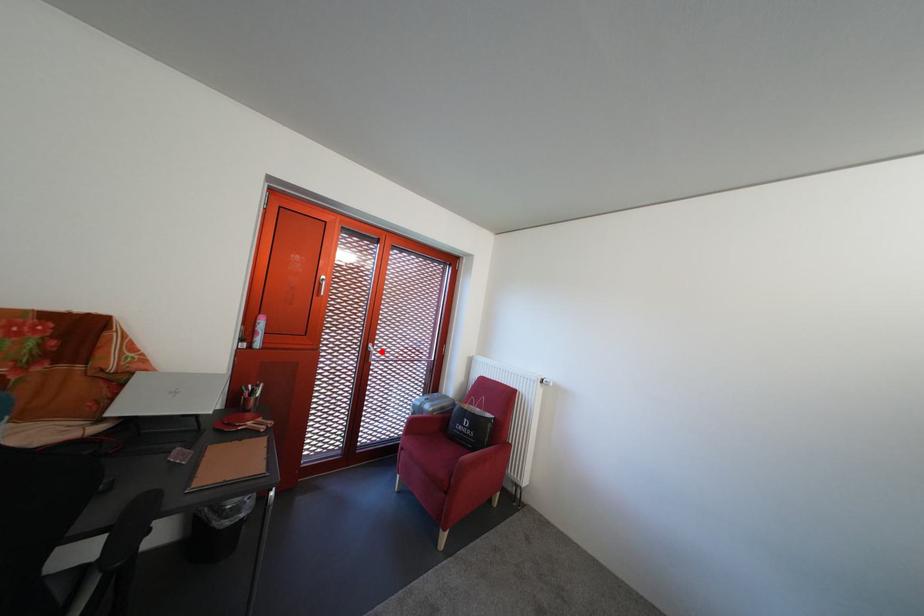
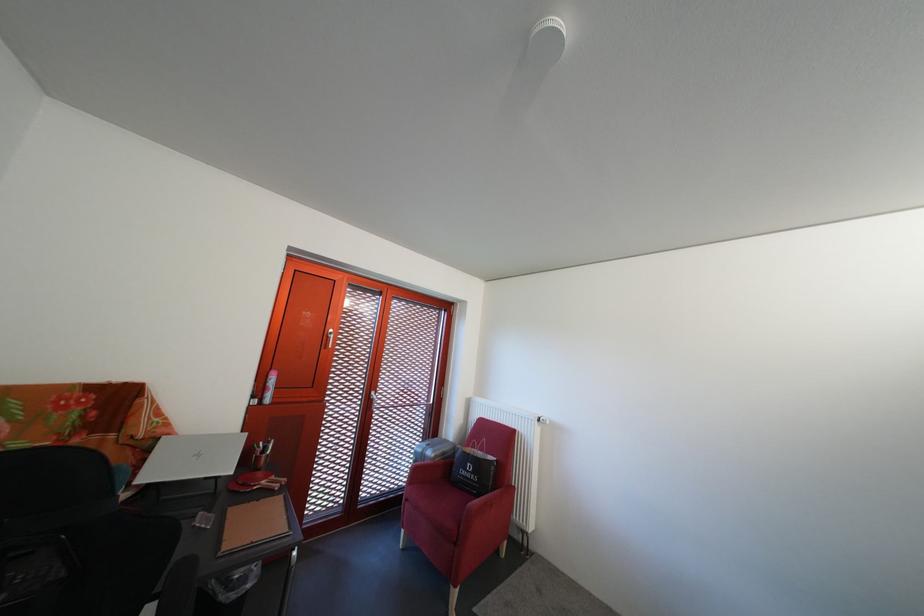
The point at the highlighted location is marked in the first image. Where is the corresponding point in the second image?

(383, 400)